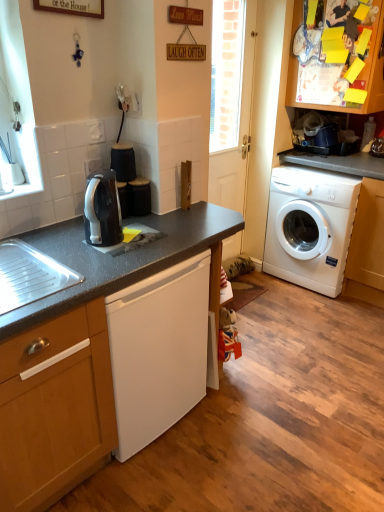
Where is `vacant area situated below black glossy kettle at upper left (from a real-world perspective)`? The height and width of the screenshot is (512, 384). vacant area situated below black glossy kettle at upper left (from a real-world perspective) is located at coordinates (121, 241).